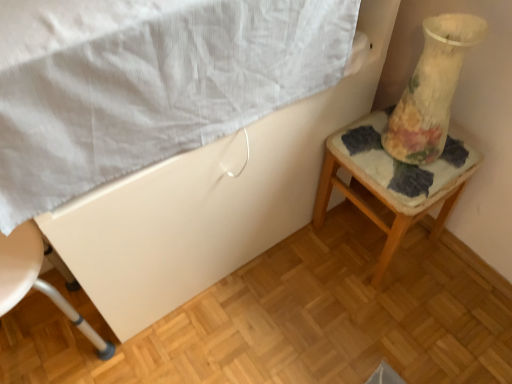
Where is `vacant area on top of floral fabric cushion at right (from a real-world perspective)`? vacant area on top of floral fabric cushion at right (from a real-world perspective) is located at coordinates (403, 164).